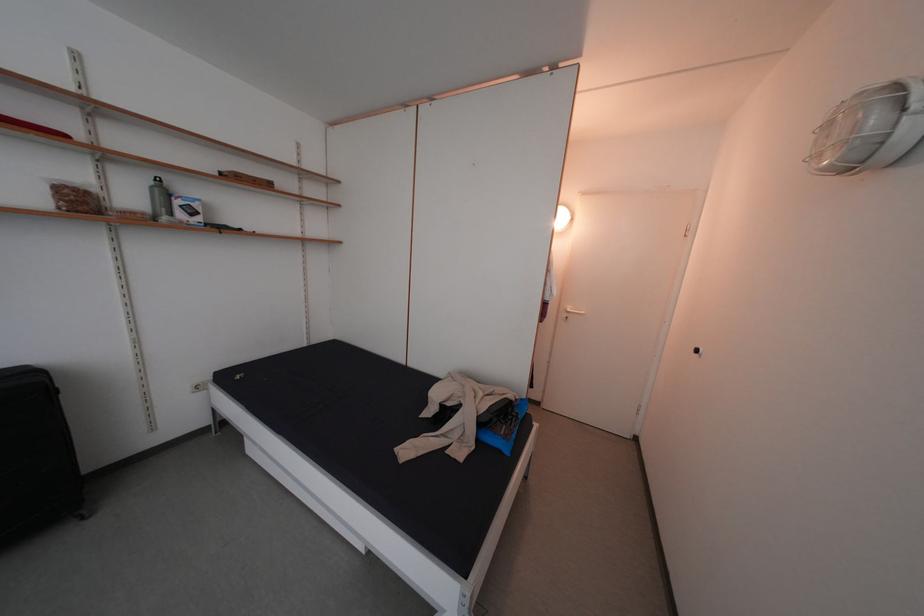
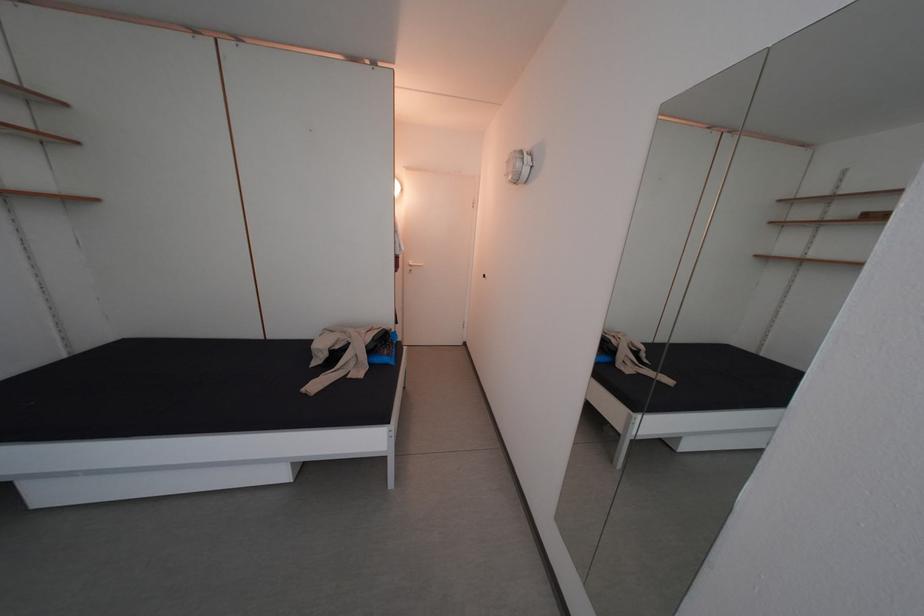
The point at (553, 310) is marked in the first image. Where is the corresponding point in the second image?

(407, 264)